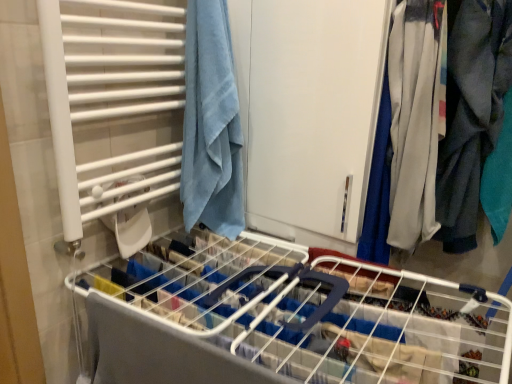
Question: Does white plastic bed frame at center have a greater height compared to white matte cabinet at center?

Choices:
 (A) no
 (B) yes

Answer: (A)

Question: Can you confirm if white plastic bed frame at center is positioned to the right of white matte cabinet at center?

Choices:
 (A) no
 (B) yes

Answer: (A)

Question: Is white plastic bed frame at center not inside white matte cabinet at center?

Choices:
 (A) yes
 (B) no

Answer: (A)

Question: Can you confirm if white plastic bed frame at center is wider than white matte cabinet at center?

Choices:
 (A) yes
 (B) no

Answer: (A)

Question: Is white plastic bed frame at center facing away from white matte cabinet at center?

Choices:
 (A) no
 (B) yes

Answer: (A)

Question: Relative to blue cotton towel at upper left, is white plastic bed frame at center in front or behind?

Choices:
 (A) front
 (B) behind

Answer: (A)

Question: Does point (x=430, y=311) appear closer or farther from the camera than point (x=197, y=18)?

Choices:
 (A) closer
 (B) farther

Answer: (A)

Question: Considering the positions of white plastic bed frame at center and blue cotton towel at upper left in the image, is white plastic bed frame at center taller or shorter than blue cotton towel at upper left?

Choices:
 (A) tall
 (B) short

Answer: (A)

Question: Looking at their shapes, would you say white plastic bed frame at center is wider or thinner than blue cotton towel at upper left?

Choices:
 (A) wide
 (B) thin

Answer: (A)

Question: Is gray cotton pants at right taller or shorter than white plastic bed frame at center?

Choices:
 (A) short
 (B) tall

Answer: (A)

Question: Is point (495, 122) closer or farther from the camera than point (202, 365)?

Choices:
 (A) farther
 (B) closer

Answer: (A)

Question: In the image, is gray cotton pants at right on the left side or the right side of white plastic bed frame at center?

Choices:
 (A) right
 (B) left

Answer: (A)

Question: From a real-world perspective, is gray cotton pants at right physically located above or below white plastic bed frame at center?

Choices:
 (A) above
 (B) below

Answer: (A)

Question: Relative to gray cotton pants at right, is white plastic bed frame at center in front or behind?

Choices:
 (A) behind
 (B) front

Answer: (B)

Question: In terms of height, does white plastic bed frame at center look taller or shorter compared to gray cotton pants at right?

Choices:
 (A) short
 (B) tall

Answer: (B)